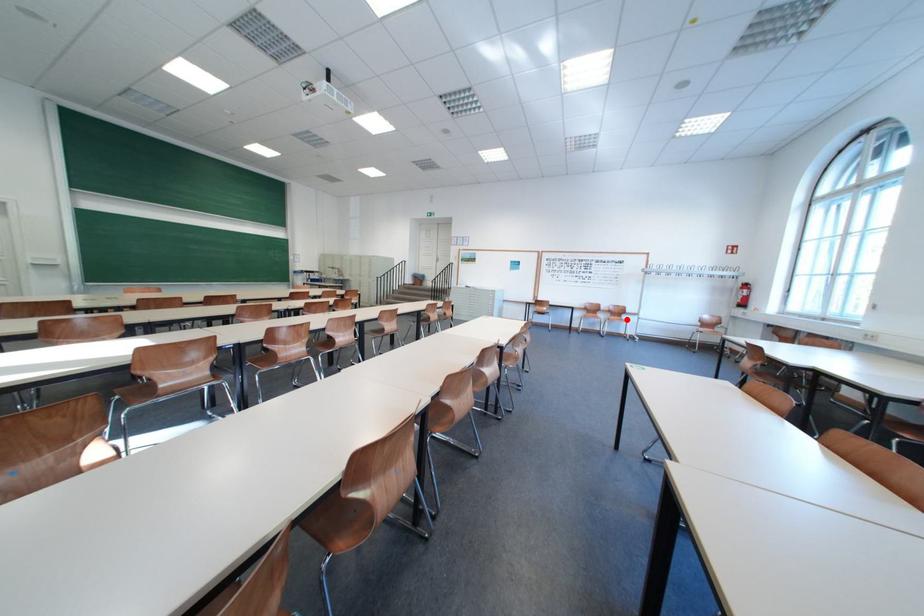
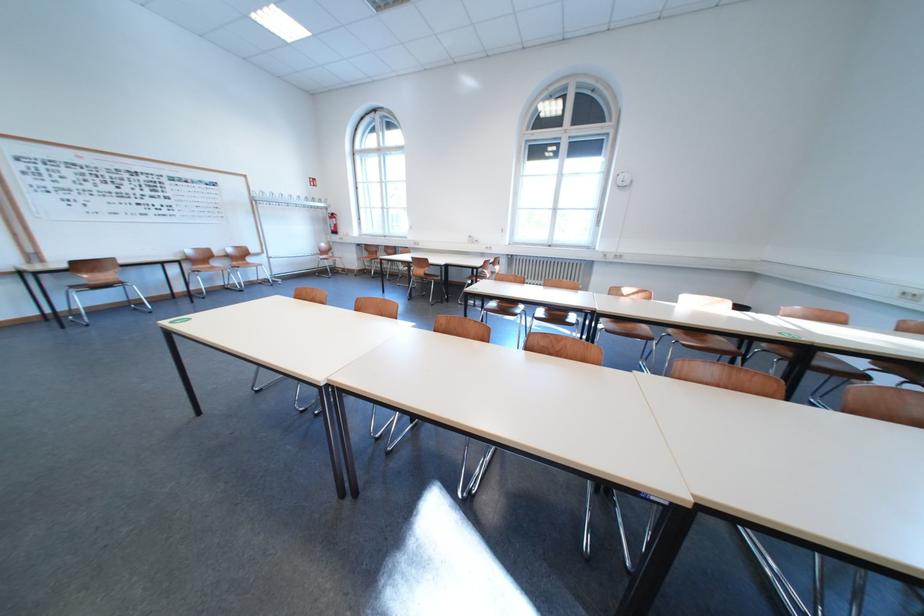
In the second image, find the point that corresponds to the highlighted location in the first image.

(249, 265)